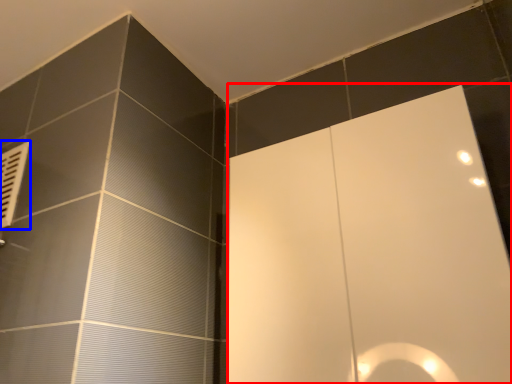
Question: Which object is closer to the camera taking this photo, screen door (highlighted by a red box) or air conditioner (highlighted by a blue box)?

Choices:
 (A) screen door
 (B) air conditioner

Answer: (A)